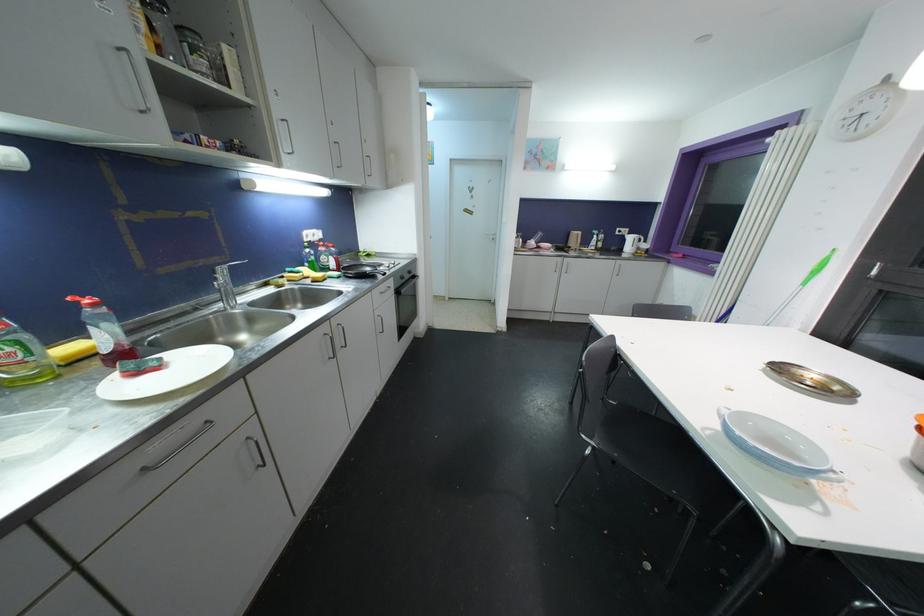
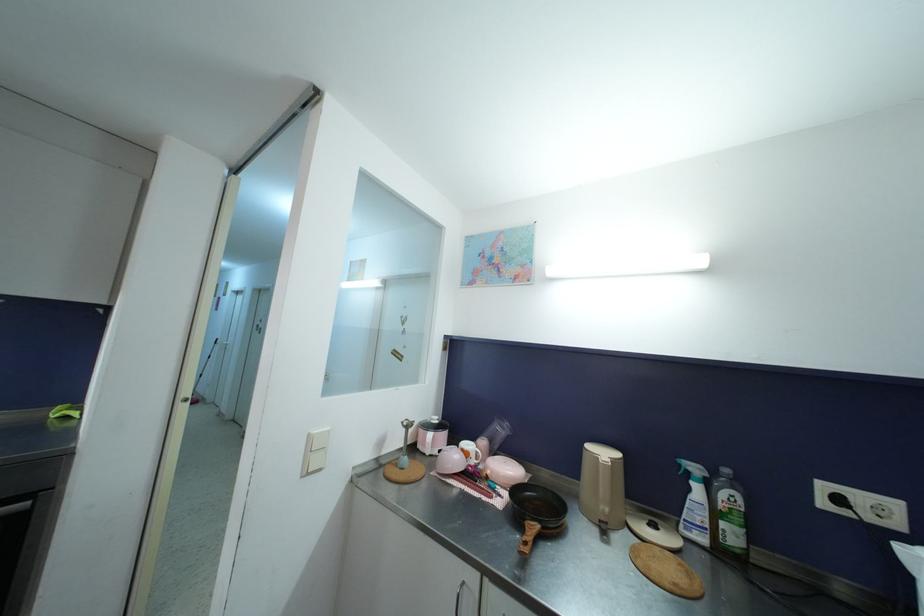
Locate, in the second image, the point that corresponds to [599,235] in the first image.

(699, 472)